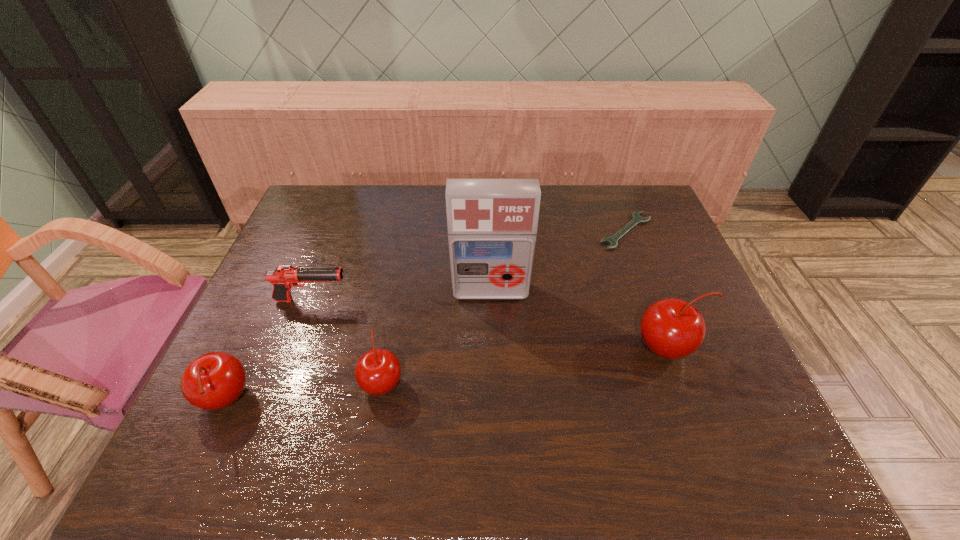
What are the coordinates of `free spot between the rightmost cherry and the gun` in the screenshot? It's located at (491, 325).

Where is `vacant area between the tallest object and the farthest object`? The height and width of the screenshot is (540, 960). vacant area between the tallest object and the farthest object is located at coordinates (558, 261).

Where is `unoccupied area between the gun and the leftmost cherry`? This screenshot has width=960, height=540. unoccupied area between the gun and the leftmost cherry is located at coordinates click(x=269, y=350).

I want to click on free point between the second tallest cherry and the second cherry from right to left, so click(x=303, y=391).

Identify the location of free space that is in between the leftmost cherry and the farthest object. (425, 316).

Where is `empty space between the rightmost cherry and the shortest cherry`? Image resolution: width=960 pixels, height=540 pixels. empty space between the rightmost cherry and the shortest cherry is located at coordinates (525, 365).

I want to click on empty space that is in between the gun and the second cherry from left to right, so click(348, 341).

The height and width of the screenshot is (540, 960). Identify the location of the second closest object relative to the third object from right to left. (671, 328).

Select which object is the second closest to the gun. Please provide its 2D coordinates. Your answer should be formatted as a tuple, i.e. [(x, y)], where the tuple contains the x and y coordinates of a point satisfying the conditions above.

[(215, 380)]

This screenshot has width=960, height=540. I want to click on cherry identified as the second closest to the rightmost cherry, so click(x=215, y=380).